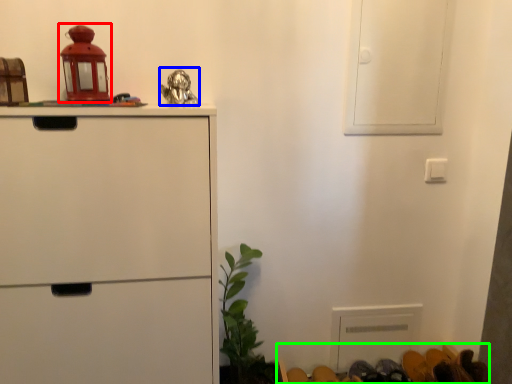
Question: Estimate the real-world distances between objects in this image. Which object is closer to toy (highlighted by a red box), toy (highlighted by a blue box) or furniture (highlighted by a green box)?

Choices:
 (A) toy
 (B) furniture

Answer: (A)